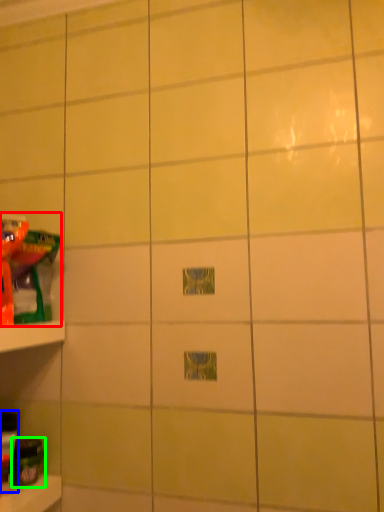
Question: Which object is the closest to the toy (highlighted by a red box)? Choose among these: toy (highlighted by a blue box) or toy (highlighted by a green box).

Choices:
 (A) toy
 (B) toy

Answer: (A)